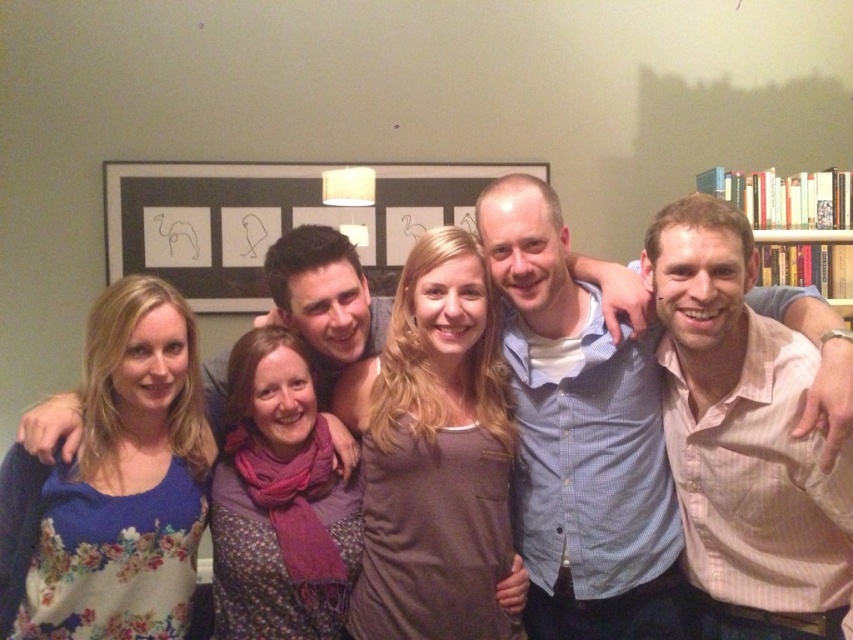
Question: Which object is positioned closest to the floral fabric dress at center?

Choices:
 (A) matte black picture frame at center
 (B) white wooden bookcase at right

Answer: (A)

Question: In this image, where is pink striped shirt at center located relative to matte black picture frame at center?

Choices:
 (A) above
 (B) below

Answer: (B)

Question: Is floral fabric dress at center below white wooden bookcase at right?

Choices:
 (A) no
 (B) yes

Answer: (B)

Question: Is pink striped shirt at center to the left of matte black picture frame at center from the viewer's perspective?

Choices:
 (A) yes
 (B) no

Answer: (B)

Question: Which of the following is the farthest from the observer?

Choices:
 (A) matte black picture frame at center
 (B) white wooden bookcase at right
 (C) floral fabric dress at center
 (D) pink striped shirt at center

Answer: (A)

Question: Which point is closer to the camera taking this photo?

Choices:
 (A) [x=799, y=250]
 (B) [x=703, y=628]

Answer: (B)